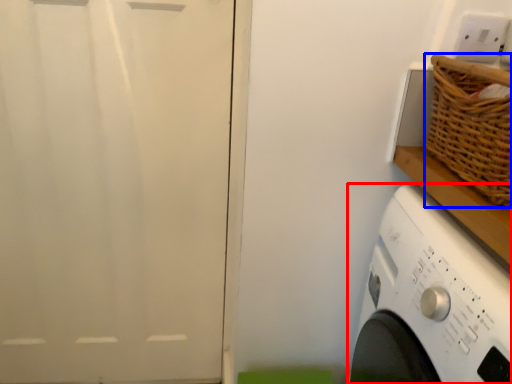
Question: Which of the following is the closest to the observer, washing machine (highlighted by a red box) or basket (highlighted by a blue box)?

Choices:
 (A) washing machine
 (B) basket

Answer: (A)